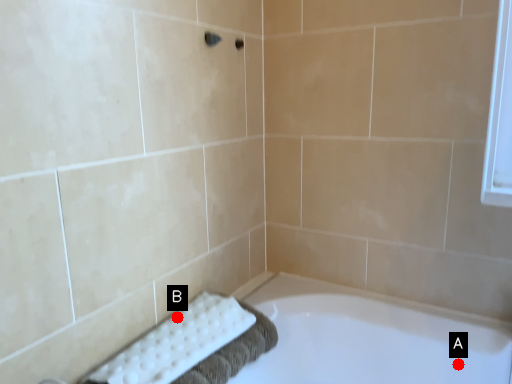
Question: Two points are circled on the image, labeled by A and B beside each circle. Among these points, which one is farthest from the camera?

Choices:
 (A) A is further
 (B) B is further

Answer: (A)